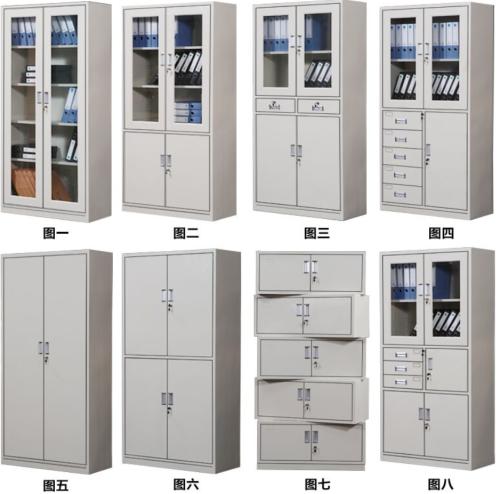
At what (x,y) coordinates should I click in order to perform the action: click on horizontal white space between top and bottom row of cavinets. Please return your answer as a coordinate pair (x, y). Looking at the image, I should click on (17, 242), (125, 244), (253, 239), (399, 237).